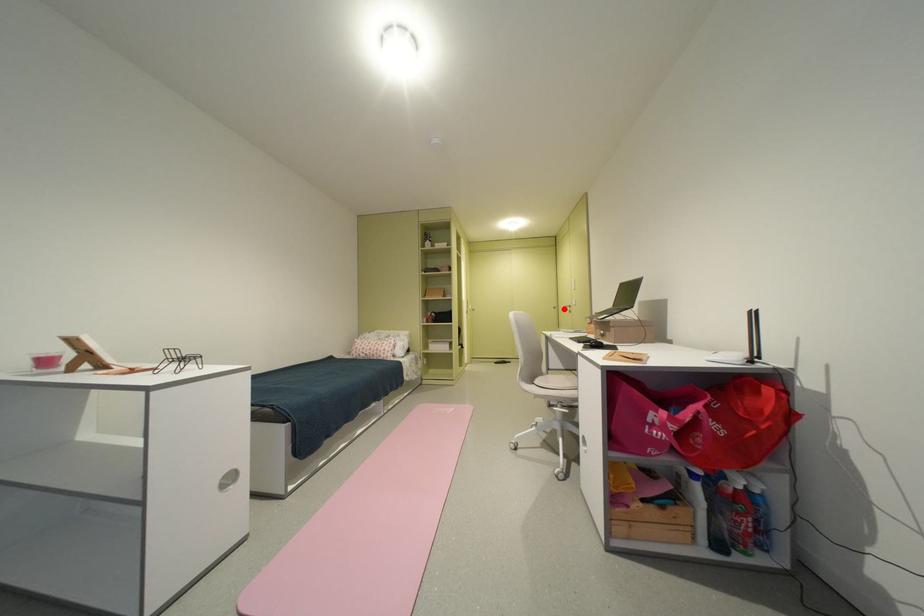
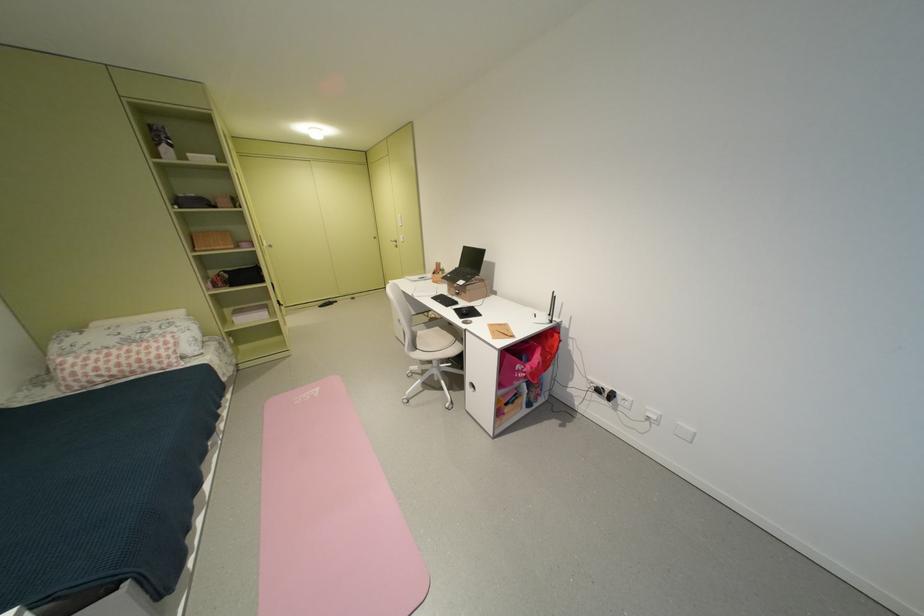
Find the pixel in the second image that matches the highlighted location in the first image.

(383, 238)